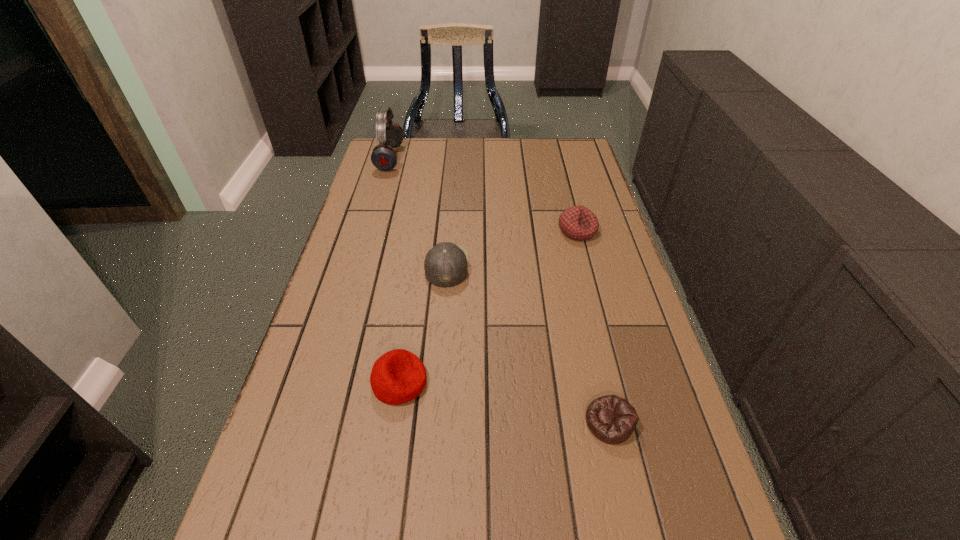
What are the coordinates of `free region located on the left of the shortest object` in the screenshot? It's located at click(519, 422).

Find the location of `object that is positioned at the far edge`. object that is positioned at the far edge is located at coordinates (384, 157).

At what (x,y) coordinates should I click in order to perform the action: click on object positioned at the left edge. Please return your answer as a coordinate pair (x, y). Looking at the image, I should click on (384, 157).

Locate an element on the screen. The height and width of the screenshot is (540, 960). object that is at the far left corner is located at coordinates (384, 157).

This screenshot has height=540, width=960. I want to click on vacant area at the far edge, so click(x=485, y=144).

Image resolution: width=960 pixels, height=540 pixels. I want to click on free space at the left edge, so click(x=403, y=202).

Locate an element on the screen. The image size is (960, 540). vacant space at the right edge of the desktop is located at coordinates (588, 176).

Identify the location of free space at the far left corner of the desktop. (402, 143).

Where is `empty space between the shortest object and the leftmost beanbag`? The height and width of the screenshot is (540, 960). empty space between the shortest object and the leftmost beanbag is located at coordinates (504, 402).

Find the location of a particular element. blank region between the leftmost beanbag and the third farthest object is located at coordinates (423, 323).